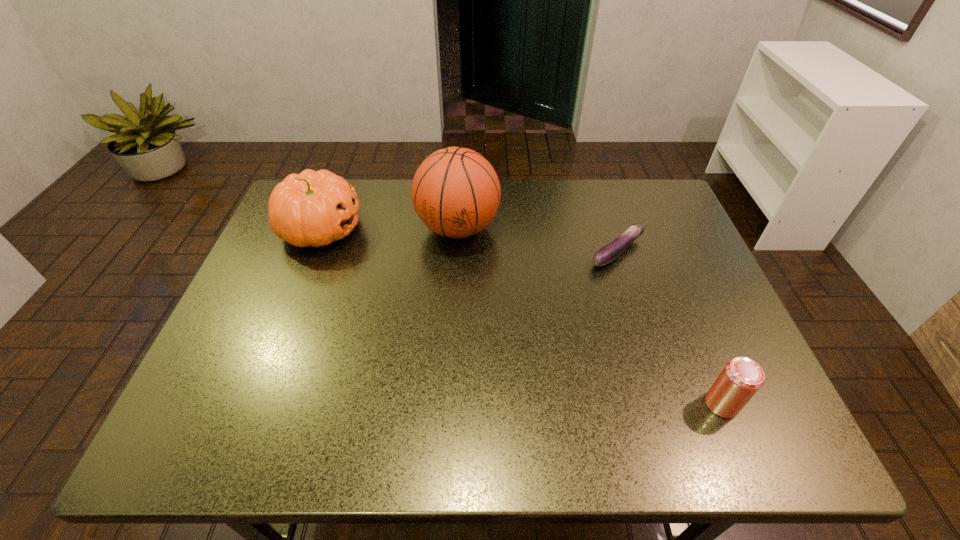
Identify the location of free space at the near edge. The height and width of the screenshot is (540, 960). pyautogui.click(x=357, y=421).

In the image, there is a desktop. Identify the location of vacant space at the left edge. Image resolution: width=960 pixels, height=540 pixels. (273, 395).

Find the location of a particular element. free point at the right edge is located at coordinates (672, 299).

Identify the location of free space at the far right corner of the desktop. The width and height of the screenshot is (960, 540). (623, 205).

Locate an element on the screen. empty location between the pumpkin and the nearest object is located at coordinates (521, 316).

You are a GUI agent. You are given a task and a screenshot of the screen. Output one action in this format:
    pyautogui.click(x=<x>, y=<y>)
    Task: Click on the free area in between the eggplant and the third tallest object
    
    Given the screenshot: What is the action you would take?
    pyautogui.click(x=670, y=328)

The height and width of the screenshot is (540, 960). In order to click on blank region between the leftmost object and the third tallest object in this screenshot , I will do `click(521, 316)`.

Where is `free space between the third tallest object and the eggplant`? Image resolution: width=960 pixels, height=540 pixels. free space between the third tallest object and the eggplant is located at coordinates (670, 328).

You are a GUI agent. You are given a task and a screenshot of the screen. Output one action in this format:
    pyautogui.click(x=<x>, y=<y>)
    Task: Click on the vacant point located between the tallest object and the eggplant
    
    Given the screenshot: What is the action you would take?
    pyautogui.click(x=538, y=240)

The image size is (960, 540). Find the location of `free spot between the third tallest object and the pumpkin`. free spot between the third tallest object and the pumpkin is located at coordinates (521, 316).